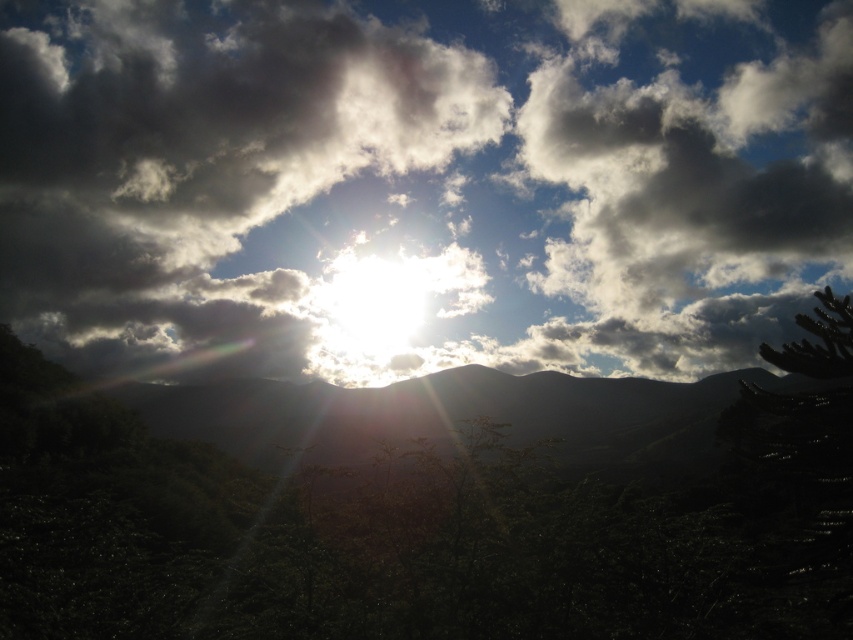
Question: Which point is closer to the camera?

Choices:
 (A) white fluffy cloud at upper center
 (B) green leafy tree at center

Answer: (B)

Question: Is white fluffy cloud at upper center positioned behind green leafy tree at center?

Choices:
 (A) yes
 (B) no

Answer: (A)

Question: Is the position of white fluffy cloud at upper center less distant than that of green leafy tree at center?

Choices:
 (A) no
 (B) yes

Answer: (A)

Question: Can you confirm if white fluffy cloud at upper center is bigger than green leafy tree at center?

Choices:
 (A) yes
 (B) no

Answer: (A)

Question: Which point appears closest to the camera in this image?

Choices:
 (A) (149, 172)
 (B) (799, 570)

Answer: (B)